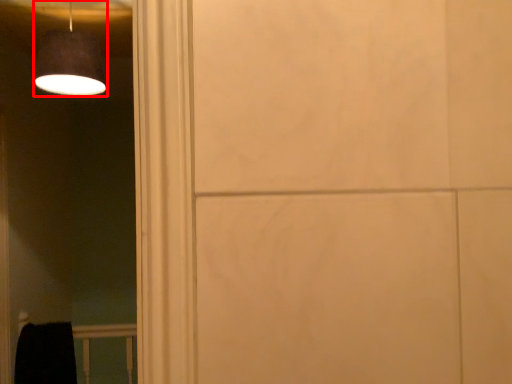
Question: From the image's perspective, what is the correct spatial positioning of lamp (annotated by the red box) in reference to balustrade?

Choices:
 (A) above
 (B) below

Answer: (A)